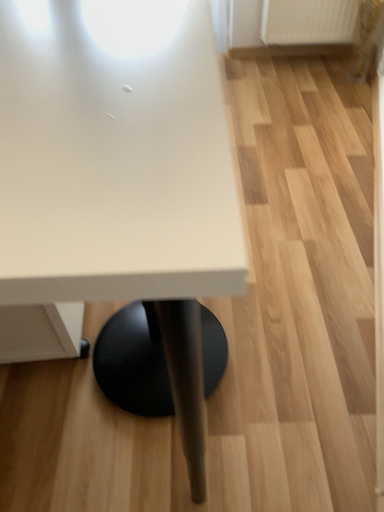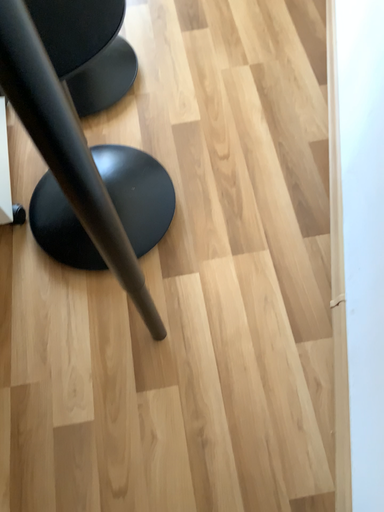
Question: Which way did the camera rotate in the video?

Choices:
 (A) rotated downward
 (B) rotated upward

Answer: (A)